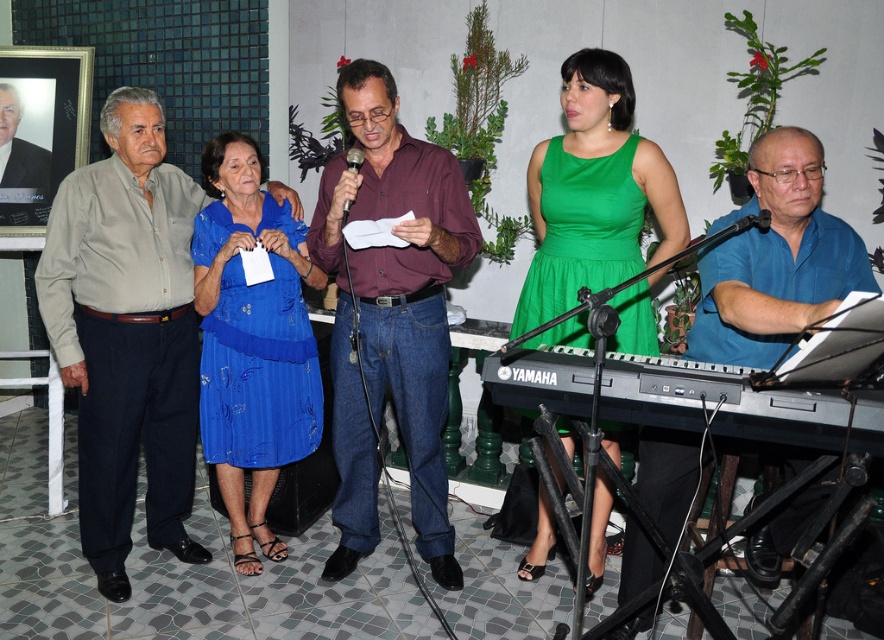
Question: Can you confirm if green satin dress at center is positioned to the right of black plastic keyboard at lower right?

Choices:
 (A) no
 (B) yes

Answer: (A)

Question: Which object is the farthest from the blue satin dress at center?

Choices:
 (A) light brown cotton shirt at left
 (B) maroon shirt at center
 (C) green satin dress at center
 (D) black plastic keyboard at lower right

Answer: (D)

Question: Does blue satin dress at center appear on the right side of blue shirt at right?

Choices:
 (A) yes
 (B) no

Answer: (B)

Question: Does maroon shirt at center appear over blue satin dress at center?

Choices:
 (A) yes
 (B) no

Answer: (A)

Question: Which object appears closest to the camera in this image?

Choices:
 (A) maroon shirt at center
 (B) light brown cotton shirt at left

Answer: (A)

Question: Among these points, which one is nearest to the camera?

Choices:
 (A) (423, 435)
 (B) (779, 320)
 (C) (843, 426)

Answer: (C)